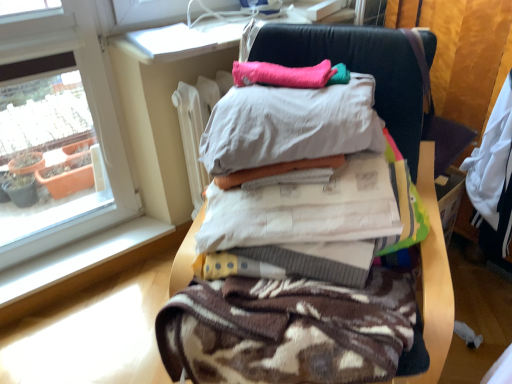
Question: Is pink fabric pillow at upper center outside of dark blue leather chair at right?

Choices:
 (A) yes
 (B) no

Answer: (A)

Question: Does pink fabric pillow at upper center appear on the left side of dark blue leather chair at right?

Choices:
 (A) no
 (B) yes

Answer: (B)

Question: Is pink fabric pillow at upper center further to the viewer compared to dark blue leather chair at right?

Choices:
 (A) no
 (B) yes

Answer: (A)

Question: Can you confirm if pink fabric pillow at upper center is smaller than dark blue leather chair at right?

Choices:
 (A) yes
 (B) no

Answer: (A)

Question: Does pink fabric pillow at upper center have a greater width compared to dark blue leather chair at right?

Choices:
 (A) no
 (B) yes

Answer: (B)

Question: Is pink fabric pillow at upper center touching dark blue leather chair at right?

Choices:
 (A) yes
 (B) no

Answer: (B)

Question: Is brown textured blanket at center located within dark blue leather chair at right?

Choices:
 (A) yes
 (B) no

Answer: (B)

Question: From a real-world perspective, is dark blue leather chair at right over brown textured blanket at center?

Choices:
 (A) no
 (B) yes

Answer: (B)

Question: Is dark blue leather chair at right to the right of brown textured blanket at center from the viewer's perspective?

Choices:
 (A) no
 (B) yes

Answer: (B)

Question: Is dark blue leather chair at right positioned in front of brown textured blanket at center?

Choices:
 (A) no
 (B) yes

Answer: (A)

Question: Is dark blue leather chair at right facing towards brown textured blanket at center?

Choices:
 (A) yes
 (B) no

Answer: (A)

Question: Can you confirm if dark blue leather chair at right is smaller than brown textured blanket at center?

Choices:
 (A) no
 (B) yes

Answer: (B)

Question: From the image's perspective, would you say dark blue leather chair at right is positioned over pink fabric pillow at upper center?

Choices:
 (A) yes
 (B) no

Answer: (B)